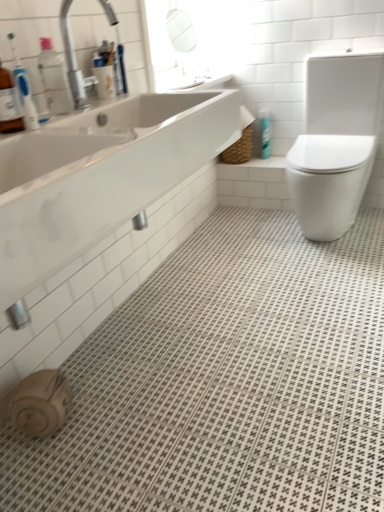
What are the coordinates of `free space in front of silver metallic faucet at upper left` in the screenshot? It's located at (88, 115).